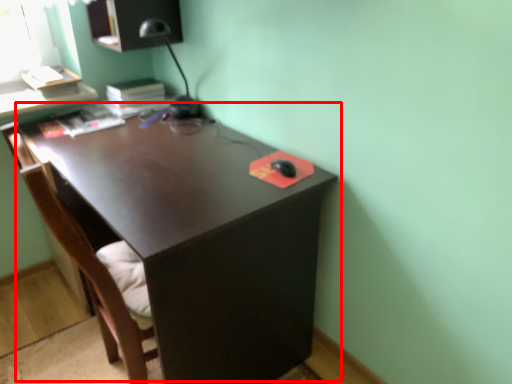
Question: Considering the relative positions of desk (annotated by the red box) and swivel chair in the image provided, where is desk (annotated by the red box) located with respect to the staircase?

Choices:
 (A) right
 (B) left

Answer: (A)